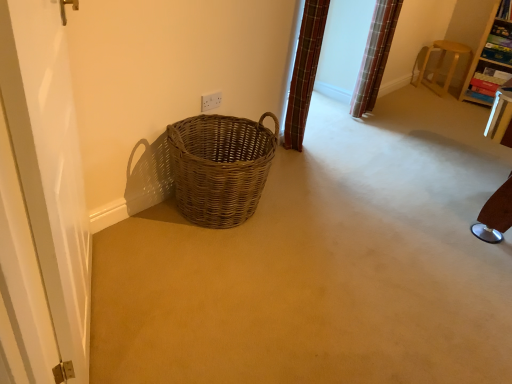
At what (x,y) coordinates should I click in order to perform the action: click on vacant space in between wooden bookshelf at upper right, acting as the 1th furniture starting from the right, and woven brown basket at center. Please return your answer as a coordinate pair (x, y). Looking at the image, I should click on (382, 141).